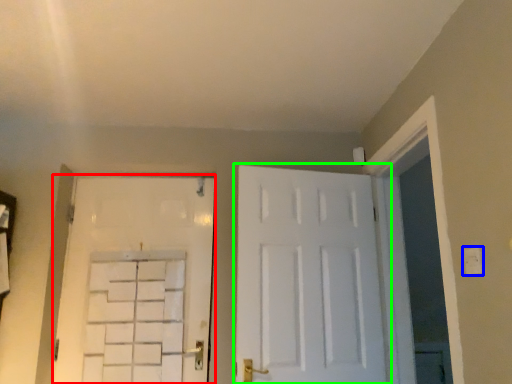
Question: Considering the real-world distances, which object is farthest from door (highlighted by a red box)? electric outlet (highlighted by a blue box) or door (highlighted by a green box)?

Choices:
 (A) electric outlet
 (B) door

Answer: (A)